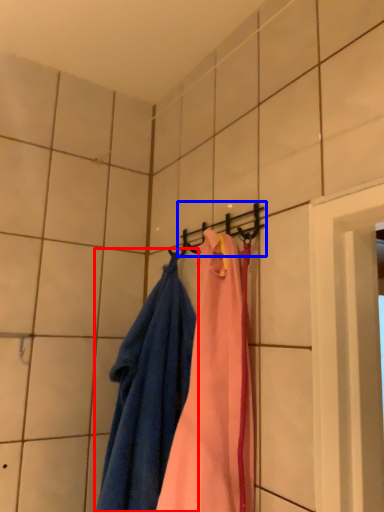
Question: Which point is further to the camera, towel (highlighted by a red box) or hanger (highlighted by a blue box)?

Choices:
 (A) towel
 (B) hanger

Answer: (B)